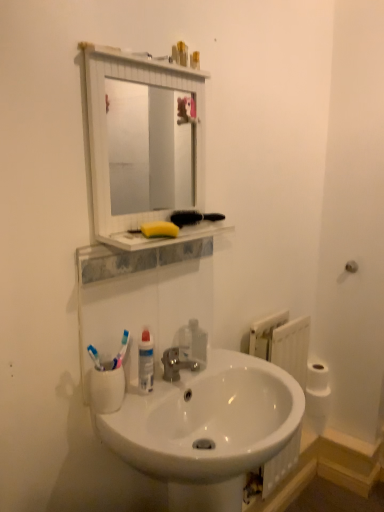
Question: Is white matte toilet paper at right positioned behind transparent plastic soap dispenser at sink?

Choices:
 (A) no
 (B) yes

Answer: (B)

Question: Is transparent plastic soap dispenser at sink at the back of white matte toilet paper at right?

Choices:
 (A) yes
 (B) no

Answer: (B)

Question: Is transparent plastic soap dispenser at sink surrounded by white matte toilet paper at right?

Choices:
 (A) no
 (B) yes

Answer: (A)

Question: From a real-world perspective, is white matte toilet paper at right located beneath transparent plastic soap dispenser at sink?

Choices:
 (A) no
 (B) yes

Answer: (B)

Question: From a real-world perspective, is white matte toilet paper at right over transparent plastic soap dispenser at sink?

Choices:
 (A) no
 (B) yes

Answer: (A)

Question: Could you tell me if white matte toilet paper at right is facing transparent plastic soap dispenser at sink?

Choices:
 (A) no
 (B) yes

Answer: (A)

Question: From the image's perspective, is yellow sponge at upper center below white matte toilet paper at right?

Choices:
 (A) no
 (B) yes

Answer: (A)

Question: From the image's perspective, is yellow sponge at upper center located above white matte toilet paper at right?

Choices:
 (A) no
 (B) yes

Answer: (B)

Question: Is yellow sponge at upper center oriented towards white matte toilet paper at right?

Choices:
 (A) yes
 (B) no

Answer: (B)

Question: Is yellow sponge at upper center outside white matte toilet paper at right?

Choices:
 (A) yes
 (B) no

Answer: (A)

Question: Would you consider yellow sponge at upper center to be distant from white matte toilet paper at right?

Choices:
 (A) no
 (B) yes

Answer: (B)

Question: Can you confirm if yellow sponge at upper center is positioned to the right of white matte toilet paper at right?

Choices:
 (A) no
 (B) yes

Answer: (A)

Question: From the image's perspective, is white matte toilet paper at right beneath white glossy sink at center?

Choices:
 (A) yes
 (B) no

Answer: (B)